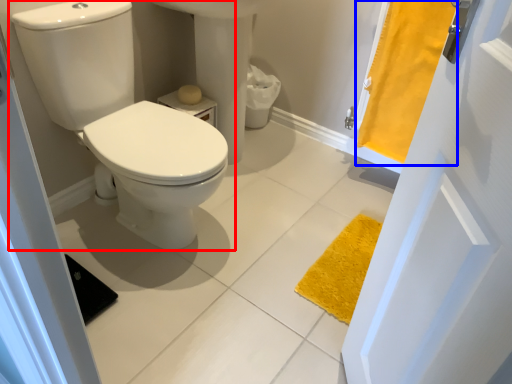
Question: Among these objects, which one is farthest to the camera, toilet (highlighted by a red box) or curtain (highlighted by a blue box)?

Choices:
 (A) toilet
 (B) curtain

Answer: (B)